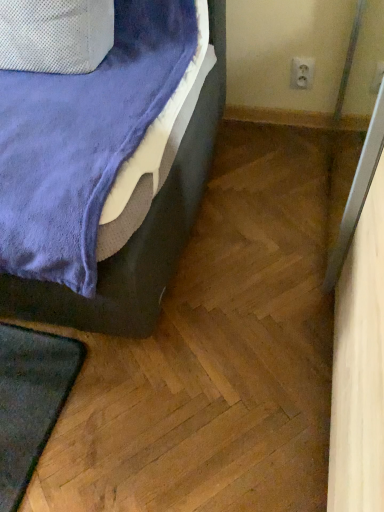
The width and height of the screenshot is (384, 512). What do you see at coordinates (302, 73) in the screenshot? I see `white plastic electric outlet at upper right` at bounding box center [302, 73].

At what (x,y) coordinates should I click in order to perform the action: click on white plastic electric outlet at upper right. Please return your answer as a coordinate pair (x, y). Looking at the image, I should click on (302, 73).

This screenshot has height=512, width=384. What do you see at coordinates (137, 237) in the screenshot?
I see `velvet blue bed at lower left` at bounding box center [137, 237].

Locate an element on the screen. This screenshot has height=512, width=384. velvet blue bed at lower left is located at coordinates (137, 237).

The image size is (384, 512). In order to click on white plastic electric outlet at upper right in this screenshot , I will do `click(302, 73)`.

Looking at this image, is white plastic electric outlet at upper right at the right side of velvet blue bed at lower left?

Indeed, white plastic electric outlet at upper right is positioned on the right side of velvet blue bed at lower left.

Is white plastic electric outlet at upper right in front of or behind velvet blue bed at lower left in the image?

Visually, white plastic electric outlet at upper right is located behind velvet blue bed at lower left.

Is point (307, 74) positioned after point (197, 127)?

Yes, point (307, 74) is behind point (197, 127).

From the image's perspective, is white plastic electric outlet at upper right above velvet blue bed at lower left?

Yes, from the image's perspective, white plastic electric outlet at upper right is above velvet blue bed at lower left.

From a real-world perspective, who is located lower, white plastic electric outlet at upper right or velvet blue bed at lower left?

white plastic electric outlet at upper right.

Considering the relative sizes of white plastic electric outlet at upper right and velvet blue bed at lower left in the image provided, is white plastic electric outlet at upper right wider than velvet blue bed at lower left?

No, white plastic electric outlet at upper right is not wider than velvet blue bed at lower left.

Considering the relative sizes of white plastic electric outlet at upper right and velvet blue bed at lower left in the image provided, is white plastic electric outlet at upper right taller than velvet blue bed at lower left?

No, white plastic electric outlet at upper right is not taller than velvet blue bed at lower left.

Is white plastic electric outlet at upper right smaller than velvet blue bed at lower left?

Yes, white plastic electric outlet at upper right is smaller than velvet blue bed at lower left.

Would you say white plastic electric outlet at upper right contains velvet blue bed at lower left?

No, velvet blue bed at lower left is not surrounded by white plastic electric outlet at upper right.

Based on the photo, are white plastic electric outlet at upper right and velvet blue bed at lower left making contact?

No, white plastic electric outlet at upper right is not next to velvet blue bed at lower left.

Could you tell me if white plastic electric outlet at upper right is facing velvet blue bed at lower left?

No, white plastic electric outlet at upper right is not turned towards velvet blue bed at lower left.

At what (x,y) coordinates should I click in order to perform the action: click on bed located below the white plastic electric outlet at upper right (from the image's perspective). Please return your answer as a coordinate pair (x, y). The width and height of the screenshot is (384, 512). Looking at the image, I should click on (137, 237).

In the scene shown: Based on their positions, is velvet blue bed at lower left located to the left or right of white plastic electric outlet at upper right?

Based on their positions, velvet blue bed at lower left is located to the left of white plastic electric outlet at upper right.

Which object is closer to the camera, velvet blue bed at lower left or white plastic electric outlet at upper right?

velvet blue bed at lower left.

Between point (165, 210) and point (290, 83), which one is positioned behind?

Positioned behind is point (290, 83).

From the image's perspective, which one is positioned lower, velvet blue bed at lower left or white plastic electric outlet at upper right?

velvet blue bed at lower left appears lower in the image.

From a real-world perspective, relative to white plastic electric outlet at upper right, is velvet blue bed at lower left vertically above or below?

Clearly, from a real-world perspective, velvet blue bed at lower left is above white plastic electric outlet at upper right.

Looking at their sizes, would you say velvet blue bed at lower left is wider or thinner than white plastic electric outlet at upper right?

Clearly, velvet blue bed at lower left has more width compared to white plastic electric outlet at upper right.

Which of these two, velvet blue bed at lower left or white plastic electric outlet at upper right, stands shorter?

white plastic electric outlet at upper right.

Who is bigger, velvet blue bed at lower left or white plastic electric outlet at upper right?

With larger size is velvet blue bed at lower left.

Based on the photo, would you say velvet blue bed at lower left is outside white plastic electric outlet at upper right?

velvet blue bed at lower left lies outside white plastic electric outlet at upper right's area.

Is velvet blue bed at lower left far from white plastic electric outlet at upper right?

velvet blue bed at lower left is near white plastic electric outlet at upper right, not far away.

In the scene shown: Is white plastic electric outlet at upper right at the back of velvet blue bed at lower left?

No, white plastic electric outlet at upper right is not at the back of velvet blue bed at lower left.

Identify the location of electric outlet below the velvet blue bed at lower left (from a real-world perspective). Image resolution: width=384 pixels, height=512 pixels. [x=302, y=73].

I want to click on bed on the left of white plastic electric outlet at upper right, so click(x=137, y=237).

Find the location of a particular element. This screenshot has width=384, height=512. bed below the white plastic electric outlet at upper right (from the image's perspective) is located at coordinates (137, 237).